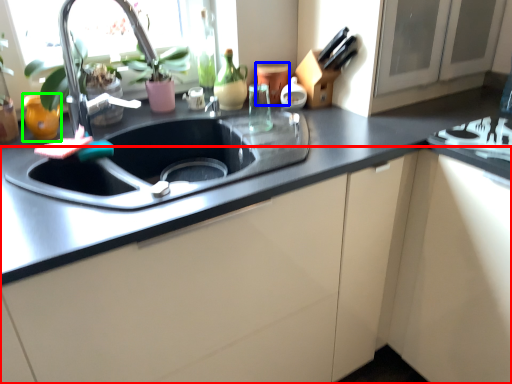
Question: Which is nearer to the cabinetry (highlighted by a red box)? appliance (highlighted by a blue box) or appliance (highlighted by a green box).

Choices:
 (A) appliance
 (B) appliance

Answer: (A)